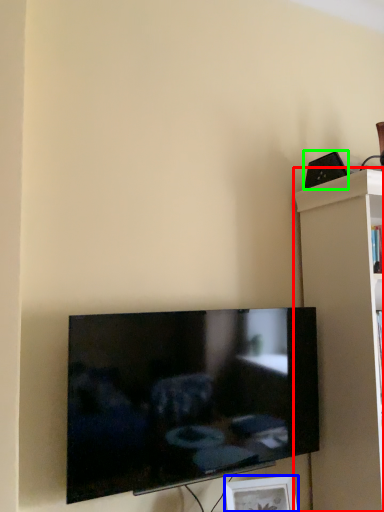
Question: Based on their relative distances, which object is nearer to shelf (highlighted by a red box)? Choose from picture frame (highlighted by a blue box) and speaker (highlighted by a green box).

Choices:
 (A) picture frame
 (B) speaker

Answer: (B)